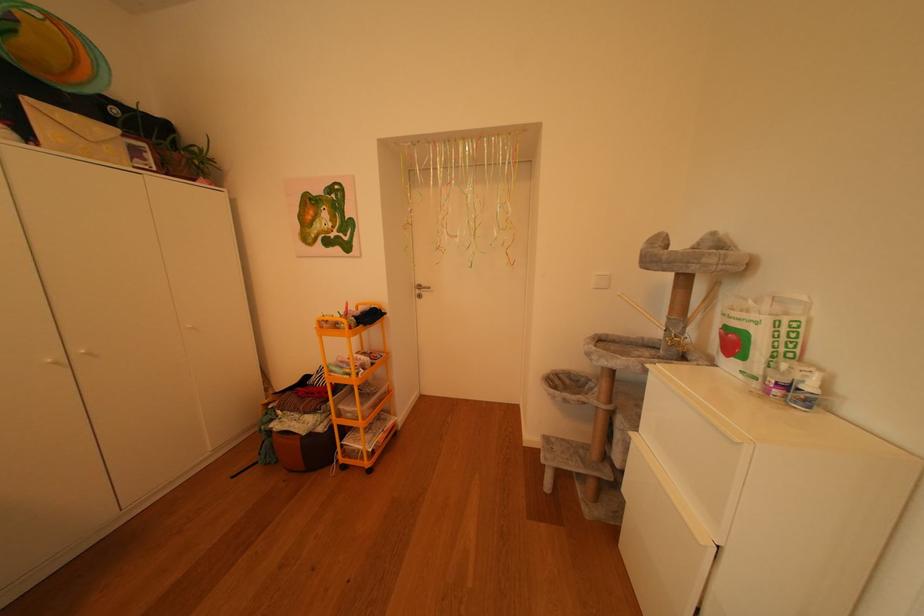
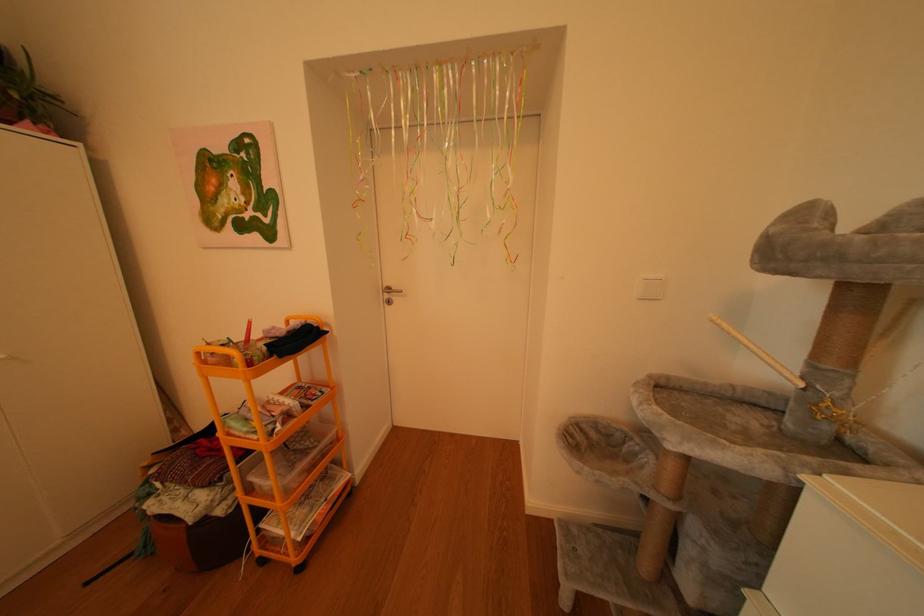
Question: The images are taken continuously from a first-person perspective. In which direction are you moving?

Choices:
 (A) Left
 (B) Right
 (C) Forward
 (D) Backward

Answer: (C)